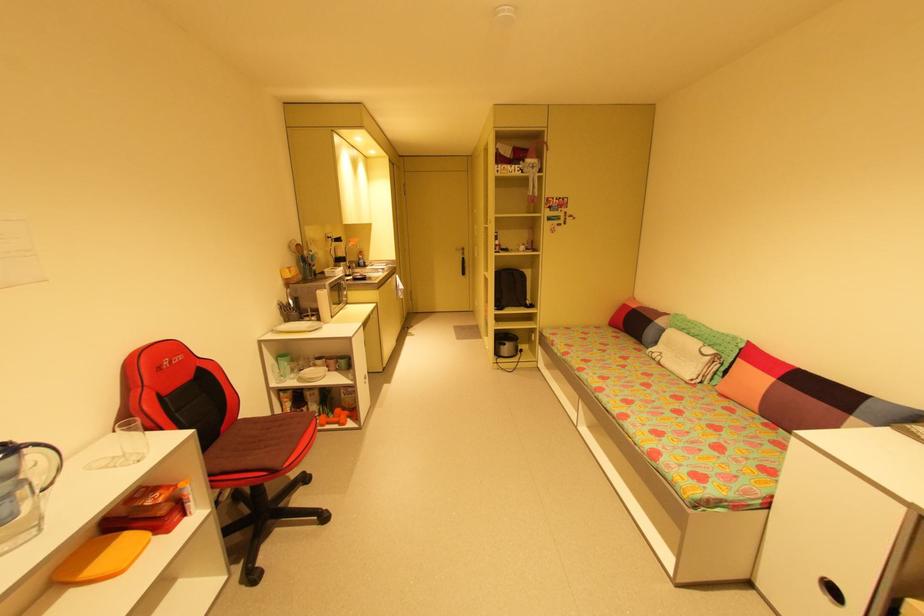
Find where to pull the black door handle. Please return your answer as a coordinate pair (x, y).

(462, 257)